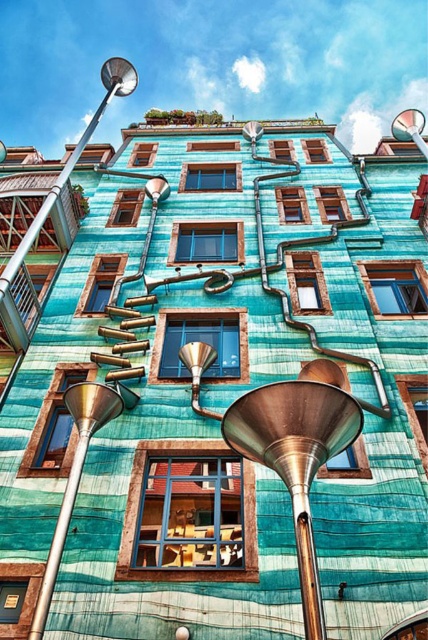
You are an architect designing a model of this building. You need to place a small decorative sphere that must be exactly halfway between the metallic teal funnel at center and the satin gold funnel at lower left. Which funnel will the sphere be closer to?

The sphere will be closer to the satin gold funnel at lower left because the metallic teal funnel at center is larger in size than the satin gold funnel at lower left, so the distance between them would mean the midpoint is nearer to the smaller one.

You are standing in front of the building and see a point marked at coordinates (296, 458). Based on the building description, which object does this point belong to?

The point at coordinates (296, 458) is on the metallic teal funnel at center.